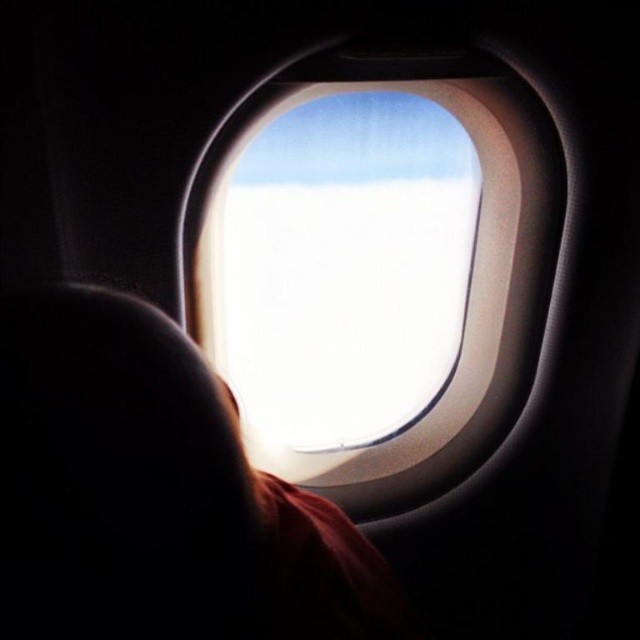
Question: Among these points, which one is farthest from the camera?

Choices:
 (A) (492, 298)
 (B) (221, 508)

Answer: (A)

Question: Which object appears closest to the camera in this image?

Choices:
 (A) silky red hair at center
 (B) transparent glass airplane window at center

Answer: (A)

Question: Can you confirm if silky red hair at center is positioned below transparent glass airplane window at center?

Choices:
 (A) no
 (B) yes

Answer: (B)

Question: Does silky red hair at center lie behind transparent glass airplane window at center?

Choices:
 (A) yes
 (B) no

Answer: (B)

Question: Can you confirm if silky red hair at center is positioned to the left of transparent glass airplane window at center?

Choices:
 (A) no
 (B) yes

Answer: (B)